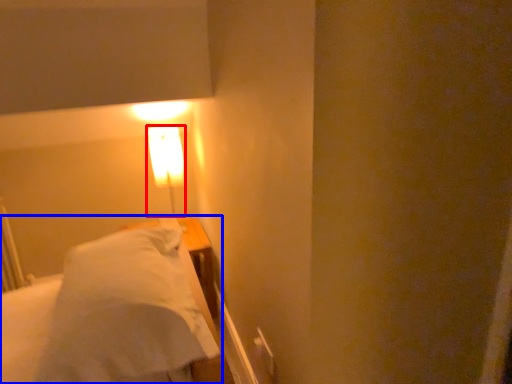
Question: Which point is further to the camera, lamp (highlighted by a red box) or bed (highlighted by a blue box)?

Choices:
 (A) lamp
 (B) bed

Answer: (A)